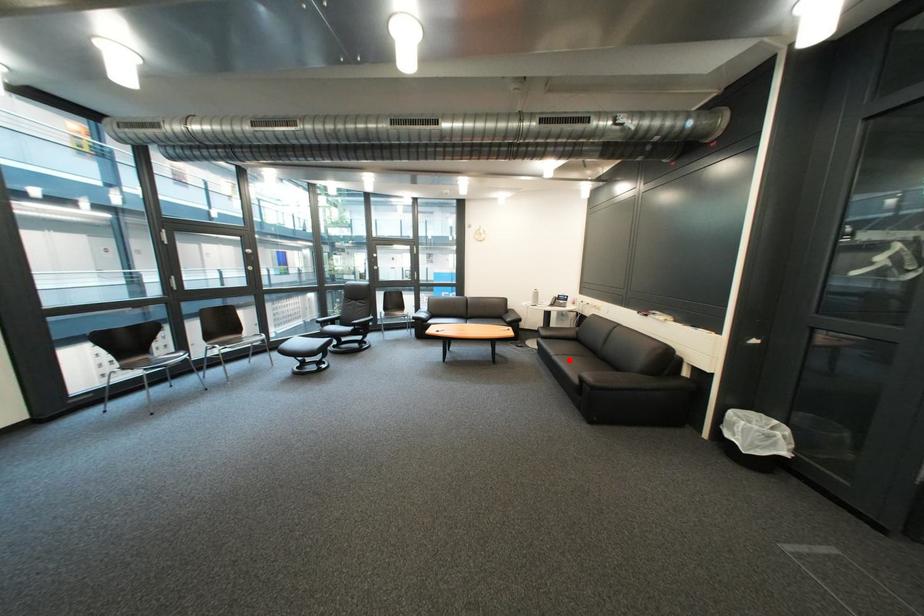
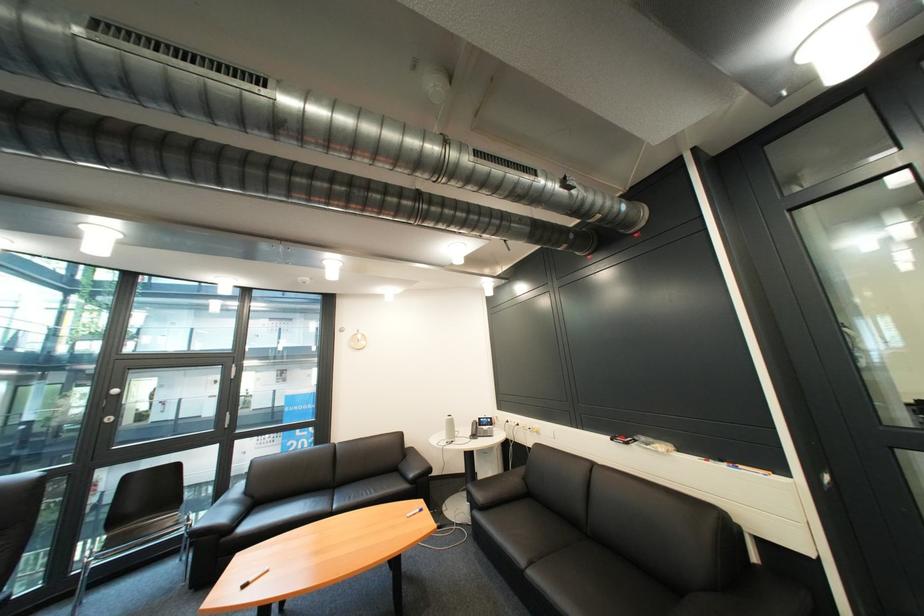
The point at the highlighted location is marked in the first image. Where is the corresponding point in the second image?

(546, 577)